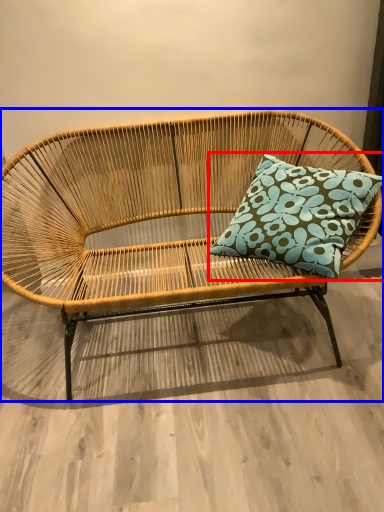
Question: Which of the following is the farthest to the observer, pillow (highlighted by a red box) or studio couch (highlighted by a blue box)?

Choices:
 (A) pillow
 (B) studio couch

Answer: (A)